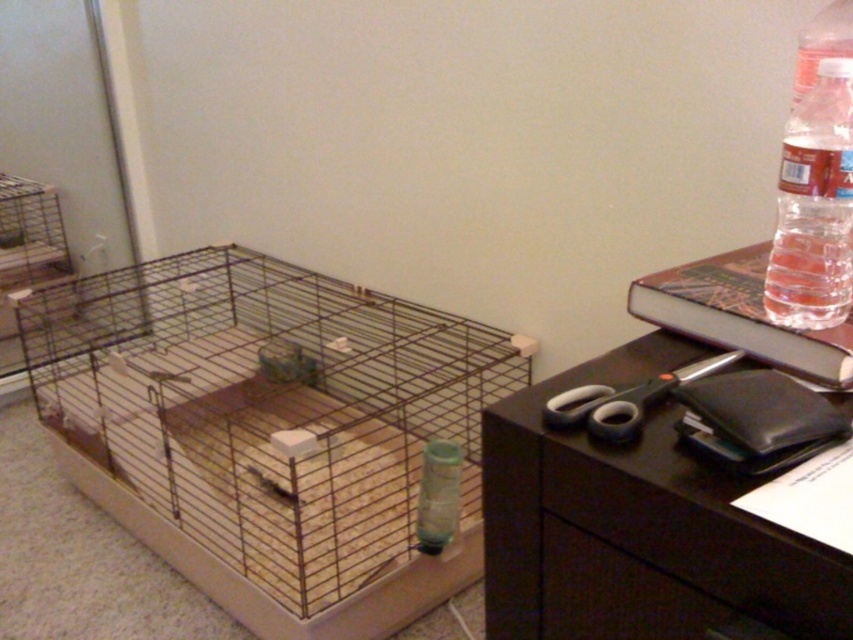
Question: Considering the real-world distances, which object is farthest from the clear plastic bottle at upper right?

Choices:
 (A) brown matte drawer at lower right
 (B) brown wire bird cage at center
 (C) black matte computer desk at right
 (D) clear plastic bottle at right

Answer: (B)

Question: Observing the image, what is the correct spatial positioning of brown matte drawer at lower right in reference to clear plastic bottle at upper right?

Choices:
 (A) below
 (B) above

Answer: (A)

Question: Among these points, which one is nearest to the camera?

Choices:
 (A) (842, 35)
 (B) (305, 301)
 (C) (799, 237)

Answer: (C)

Question: Which point appears farthest from the camera in this image?

Choices:
 (A) (849, 76)
 (B) (590, 588)
 (C) (392, 397)
 (D) (613, 570)

Answer: (C)

Question: Does black matte computer desk at right appear on the left side of brown matte drawer at lower right?

Choices:
 (A) no
 (B) yes

Answer: (A)

Question: Does brown wire bird cage at center have a lesser width compared to brown matte drawer at lower right?

Choices:
 (A) yes
 (B) no

Answer: (B)